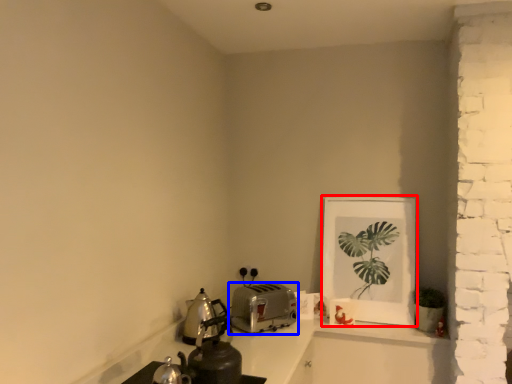
Question: Which object is closer to the camera taking this photo, picture frame (highlighted by a red box) or kitchen appliance (highlighted by a blue box)?

Choices:
 (A) picture frame
 (B) kitchen appliance

Answer: (B)